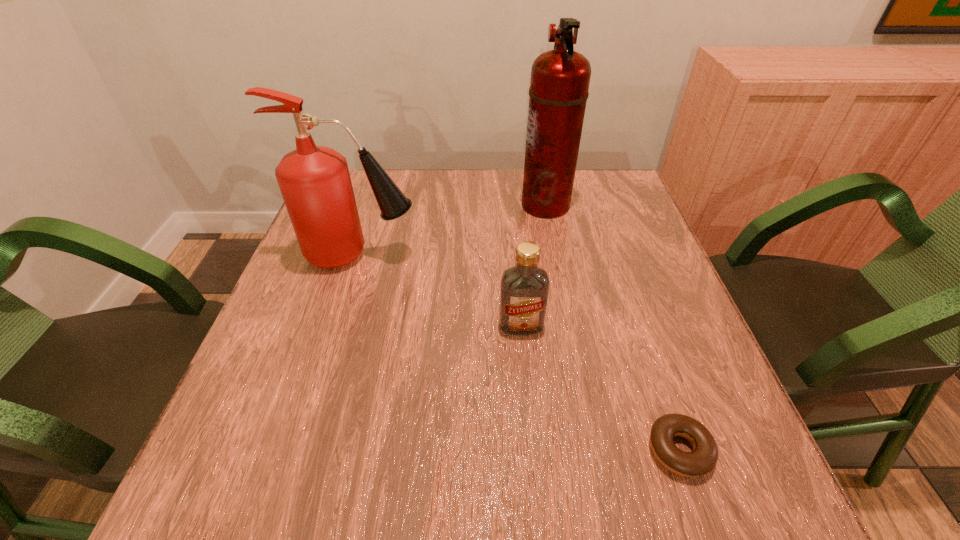
Find the location of a particular element. vacant space at the left edge of the desktop is located at coordinates (372, 217).

In the image, there is a desktop. Where is `vacant region at the right edge`? The image size is (960, 540). vacant region at the right edge is located at coordinates (594, 226).

What are the coordinates of `free region at the far left corner of the desktop` in the screenshot? It's located at (371, 212).

This screenshot has width=960, height=540. In the image, there is a desktop. What are the coordinates of `vacant space at the far right corner` in the screenshot? It's located at (612, 184).

This screenshot has width=960, height=540. In order to click on unoccupied position between the shortest object and the farthest object in this screenshot , I will do `click(612, 327)`.

Where is `free space between the shorter fire extinguisher and the taller fire extinguisher`? free space between the shorter fire extinguisher and the taller fire extinguisher is located at coordinates (453, 230).

At what (x,y) coordinates should I click in order to perform the action: click on free point between the third farthest object and the nearer fire extinguisher. Please return your answer as a coordinate pair (x, y). Looking at the image, I should click on (441, 290).

I want to click on free point between the left fire extinguisher and the taller fire extinguisher, so click(x=453, y=230).

The image size is (960, 540). In order to click on vacant area that lies between the right fire extinguisher and the second tallest object in this screenshot , I will do `click(453, 230)`.

You are a GUI agent. You are given a task and a screenshot of the screen. Output one action in this format:
    pyautogui.click(x=<x>, y=<y>)
    Task: Click on the free space between the nearer fire extinguisher and the right fire extinguisher
    This screenshot has width=960, height=540.
    Given the screenshot: What is the action you would take?
    pyautogui.click(x=453, y=230)